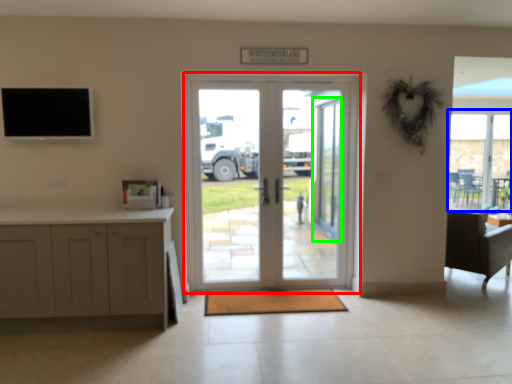
Question: Which object is the farthest from door (highlighted by a red box)? Choose among these: window (highlighted by a blue box) or screen door (highlighted by a green box).

Choices:
 (A) window
 (B) screen door

Answer: (A)